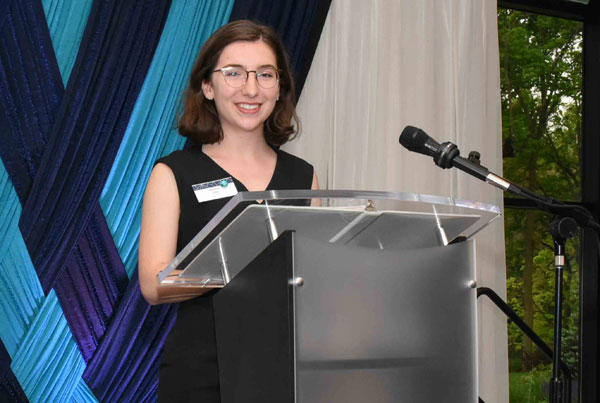
The image size is (600, 403). What are the coordinates of `window pane` in the screenshot? It's located at (552, 10), (591, 77), (590, 195), (589, 306), (589, 385).